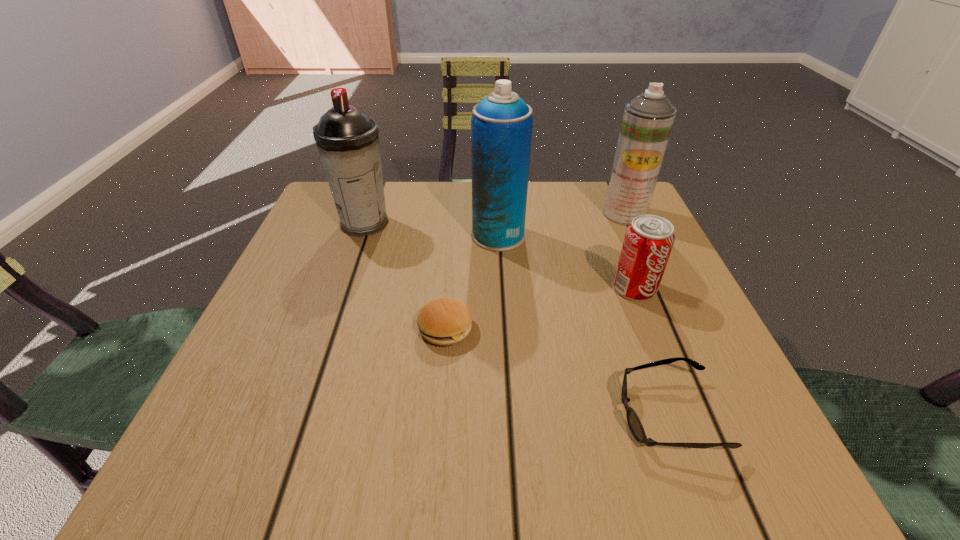
Locate an element on the screen. the second aerosol can from left to right is located at coordinates (501, 125).

At what (x,y) coordinates should I click in order to perform the action: click on the leftmost object. Please return your answer as a coordinate pair (x, y). Image resolution: width=960 pixels, height=540 pixels. Looking at the image, I should click on tap(347, 139).

Find the location of a particular element. the rightmost aerosol can is located at coordinates (647, 121).

The image size is (960, 540). In order to click on the fourth tallest object in this screenshot , I will do `click(649, 239)`.

This screenshot has height=540, width=960. Find the location of `soda can`. soda can is located at coordinates (649, 239).

Identify the location of the fifth farthest object. This screenshot has height=540, width=960. (444, 321).

The width and height of the screenshot is (960, 540). Find the location of `sunglasses`. sunglasses is located at coordinates (634, 423).

The image size is (960, 540). Identify the location of vacant space located on the front of the second aerosol can from left to right. (509, 425).

I want to click on vacant point located on the front of the leftmost object, so click(320, 352).

This screenshot has height=540, width=960. I want to click on free space located on the left of the rightmost aerosol can, so click(x=514, y=213).